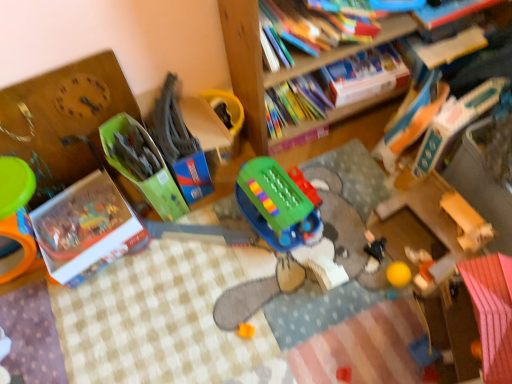
Question: Which direction should I rotate to look at green plastic toy at center, positioned as the third toy in right-to-left order?

Choices:
 (A) left
 (B) right

Answer: (B)

Question: Is hardcover book at upper right, the 5th book when ordered from left to right, wider than hardcover book at upper right, the fourth book positioned from the right?

Choices:
 (A) yes
 (B) no

Answer: (A)

Question: Considering the relative sizes of hardcover book at upper right, the 5th book when ordered from left to right, and hardcover book at upper right, the 2th book from the left, in the image provided, is hardcover book at upper right, the 5th book when ordered from left to right, bigger than hardcover book at upper right, the 2th book from the left,?

Choices:
 (A) yes
 (B) no

Answer: (A)

Question: Is hardcover book at upper right, the 5th book when ordered from left to right, directly adjacent to hardcover book at upper right, the 2th book from the left?

Choices:
 (A) no
 (B) yes

Answer: (A)

Question: Considering the relative sizes of hardcover book at upper right, the 5th book when ordered from left to right, and hardcover book at upper right, the fourth book positioned from the right, in the image provided, is hardcover book at upper right, the 5th book when ordered from left to right, shorter than hardcover book at upper right, the fourth book positioned from the right,?

Choices:
 (A) yes
 (B) no

Answer: (B)

Question: Does hardcover book at upper right, the 5th book when ordered from left to right, appear on the right side of hardcover book at upper right, the fourth book positioned from the right?

Choices:
 (A) no
 (B) yes

Answer: (B)

Question: Is hardcover book at upper right, the first book when ordered from right to left, positioned before hardcover book at upper right, the fourth book positioned from the right?

Choices:
 (A) no
 (B) yes

Answer: (A)

Question: Does hardcover book at upper right, the second book when ordered from right to left, have a lesser height compared to green cardboard box at center, placed as the 1th toy when sorted from left to right?

Choices:
 (A) no
 (B) yes

Answer: (B)

Question: Is hardcover book at upper right, the second book when ordered from right to left, facing away from green cardboard box at center, the sixth toy viewed from the right?

Choices:
 (A) no
 (B) yes

Answer: (A)

Question: Is hardcover book at upper right, which is the fourth book in left-to-right order, surrounding green cardboard box at center, placed as the 1th toy when sorted from left to right?

Choices:
 (A) no
 (B) yes

Answer: (A)

Question: Does hardcover book at upper right, which is the fourth book in left-to-right order, appear on the right side of green cardboard box at center, placed as the 1th toy when sorted from left to right?

Choices:
 (A) no
 (B) yes

Answer: (B)

Question: From the image's perspective, would you say hardcover book at upper right, the second book when ordered from right to left, is shown under green cardboard box at center, the sixth toy viewed from the right?

Choices:
 (A) no
 (B) yes

Answer: (A)

Question: Does hardcover book at upper right, which is the fourth book in left-to-right order, have a smaller size compared to green cardboard box at center, placed as the 1th toy when sorted from left to right?

Choices:
 (A) yes
 (B) no

Answer: (A)

Question: Is hardcover book at upper right, the second book when ordered from right to left, completely or partially outside of hardcover book at upper right, the fourth book positioned from the right?

Choices:
 (A) no
 (B) yes

Answer: (B)